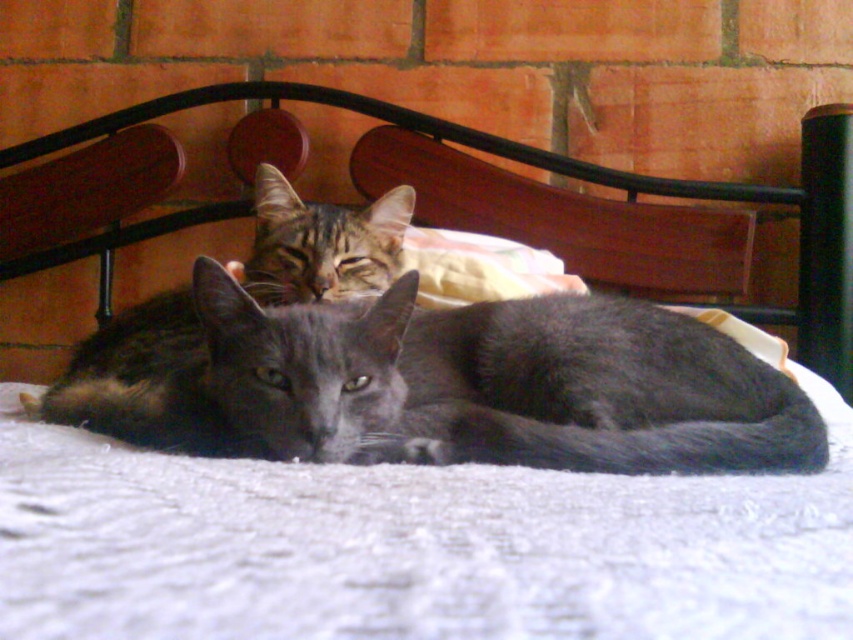
Question: Where is shiny gray cat at center located in relation to gray fur cat at center in the image?

Choices:
 (A) right
 (B) left

Answer: (A)

Question: Which point is closer to the camera?

Choices:
 (A) gray fur cat at center
 (B) shiny gray cat at center

Answer: (B)

Question: Does shiny gray cat at center lie behind gray fur cat at center?

Choices:
 (A) yes
 (B) no

Answer: (B)

Question: Is shiny gray cat at center to the right of gray fur cat at center from the viewer's perspective?

Choices:
 (A) yes
 (B) no

Answer: (A)